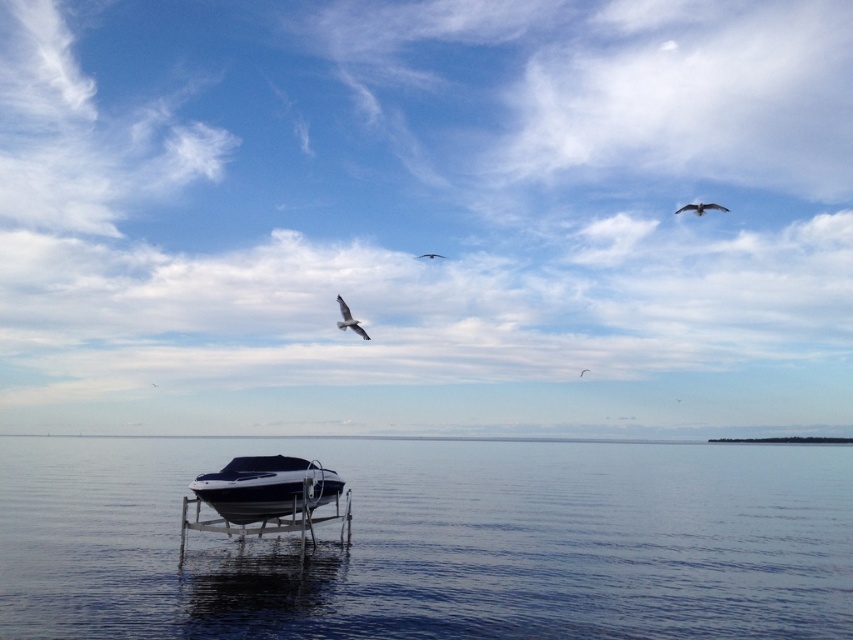
Question: Does white feathered bird at upper right have a lesser width compared to white feathered bird at upper center?

Choices:
 (A) no
 (B) yes

Answer: (A)

Question: Can you confirm if glossy water at center is positioned above white feathered bird at upper center?

Choices:
 (A) no
 (B) yes

Answer: (A)

Question: Can you confirm if white feathered bird at upper right is bigger than white feathered bird at upper center?

Choices:
 (A) yes
 (B) no

Answer: (A)

Question: Which object is positioned closest to the black matte boat at center?

Choices:
 (A) white feathered bird at upper center
 (B) white matte bird at center

Answer: (B)

Question: Which point is farther from the camera taking this photo?

Choices:
 (A) (418, 257)
 (B) (22, 604)

Answer: (A)

Question: Which object is positioned farthest from the black matte boat at center?

Choices:
 (A) white matte bird at center
 (B) white feathered bird at center
 (C) white feathered bird at upper right

Answer: (A)